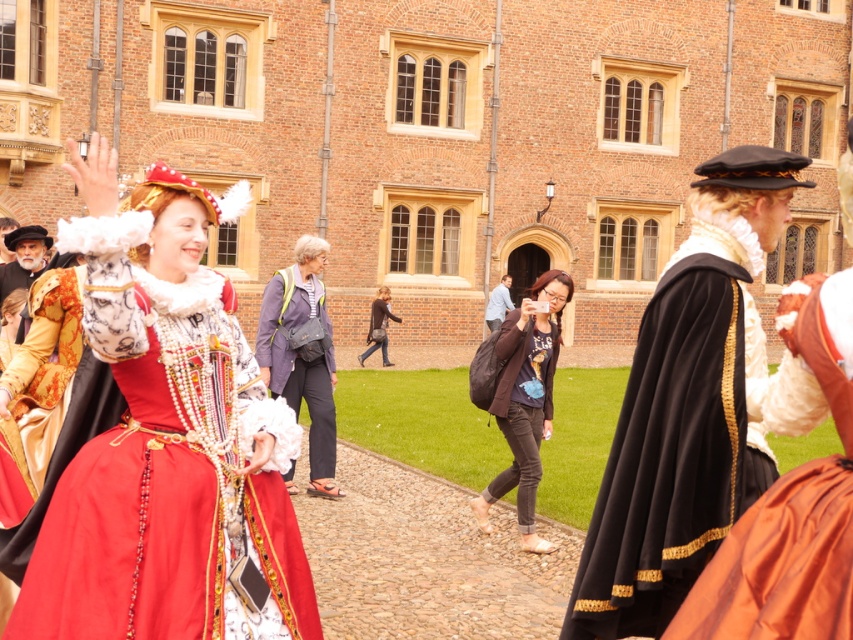
Question: Considering the real-world distances, which object is farthest from the denim jeans at center?

Choices:
 (A) matte gold hat at upper left
 (B) silky orange gown at right
 (C) dark brown leather jacket at center

Answer: (B)

Question: Is silky orange gown at right thinner than denim jeans at center?

Choices:
 (A) no
 (B) yes

Answer: (A)

Question: Does matte red gown at center have a greater width compared to matte gold hat at upper left?

Choices:
 (A) yes
 (B) no

Answer: (B)

Question: Estimate the real-world distances between objects in this image. Which object is farther from the velvet black cape at center?

Choices:
 (A) matte gold hat at upper left
 (B) matte red gown at center
 (C) dark brown leather jacket at center

Answer: (A)

Question: From the image, what is the correct spatial relationship of gray fabric jacket at center in relation to matte gold hat at upper left?

Choices:
 (A) below
 (B) above

Answer: (A)

Question: Which of the following is the farthest from the observer?

Choices:
 (A) velvet black cape at center
 (B) matte red gown at center
 (C) smooth blue shirt at center

Answer: (C)